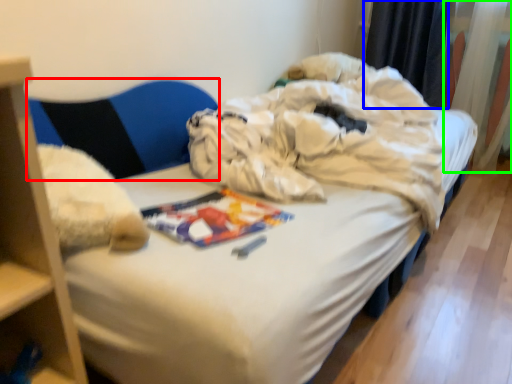
Question: Which is nearer to the armchair (highlighted by a red box)? curtain (highlighted by a blue box) or curtain (highlighted by a green box).

Choices:
 (A) curtain
 (B) curtain

Answer: (A)